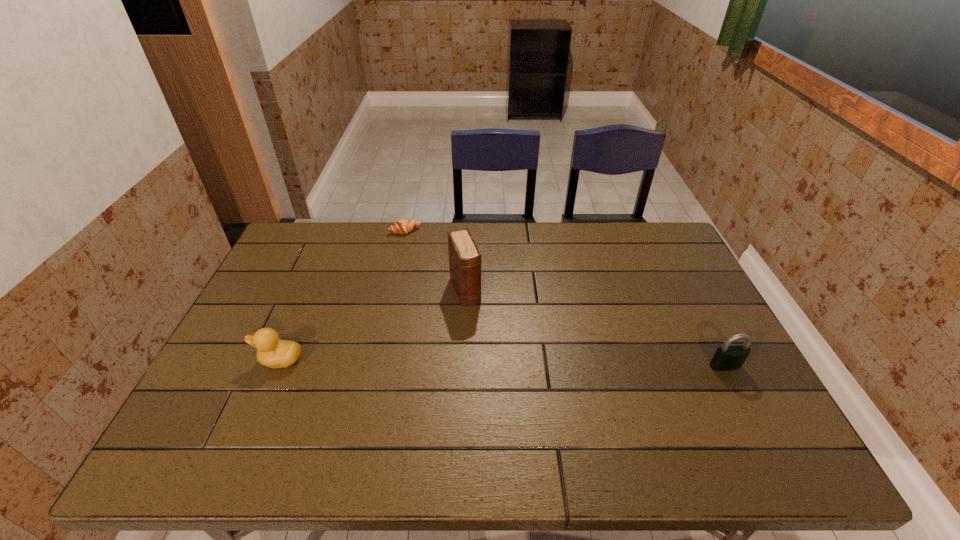
Locate an element on the screen. vacant space on the desktop that is between the leftmost object and the rightmost object and is positioned on the spine side of the second object from right to left is located at coordinates (496, 363).

Where is `vacant space on the desktop that is between the leftmost object and the padlock and is positioned on the front-facing side of the shortest object`? This screenshot has height=540, width=960. vacant space on the desktop that is between the leftmost object and the padlock and is positioned on the front-facing side of the shortest object is located at coordinates (471, 362).